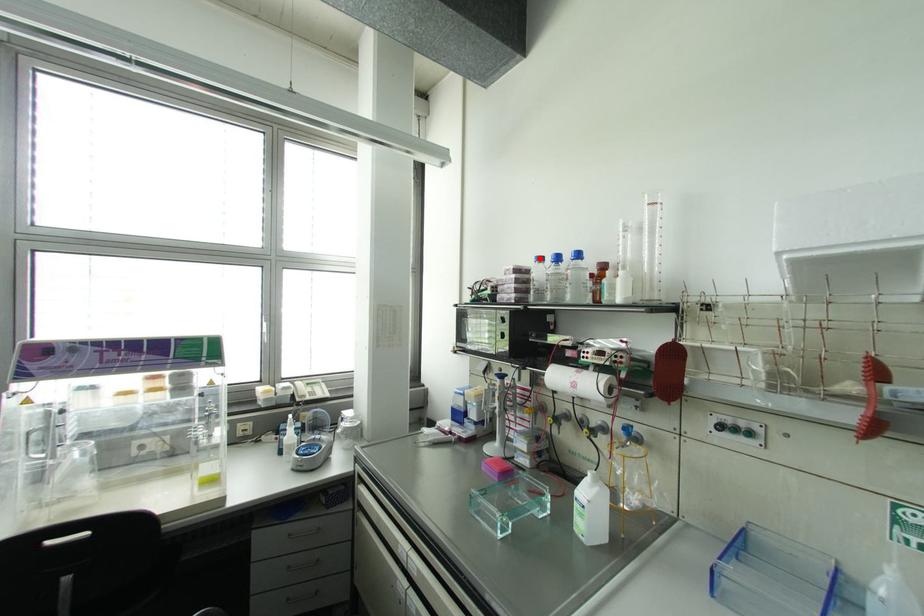
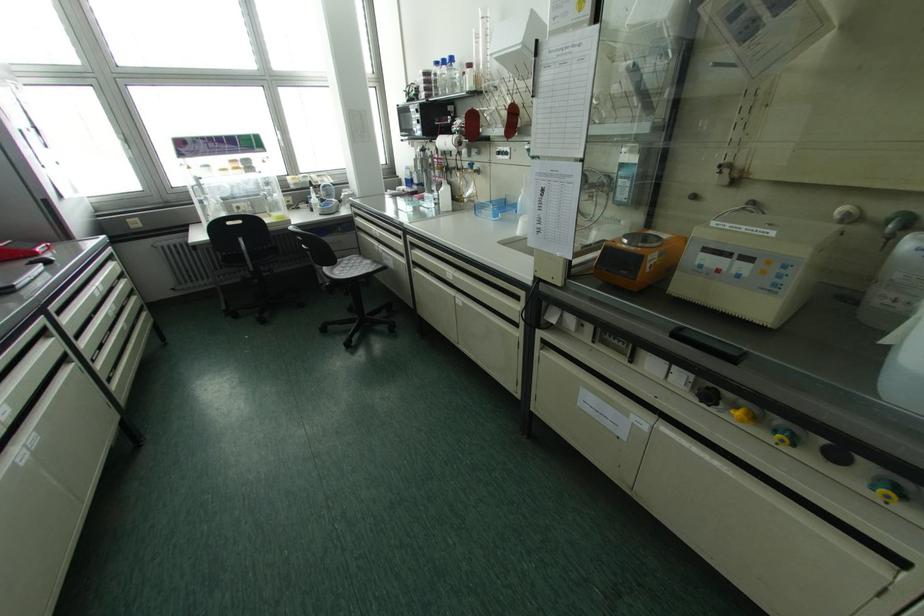
Where in the second image is the point corresponding to the highlighted location from the first image?

(435, 63)